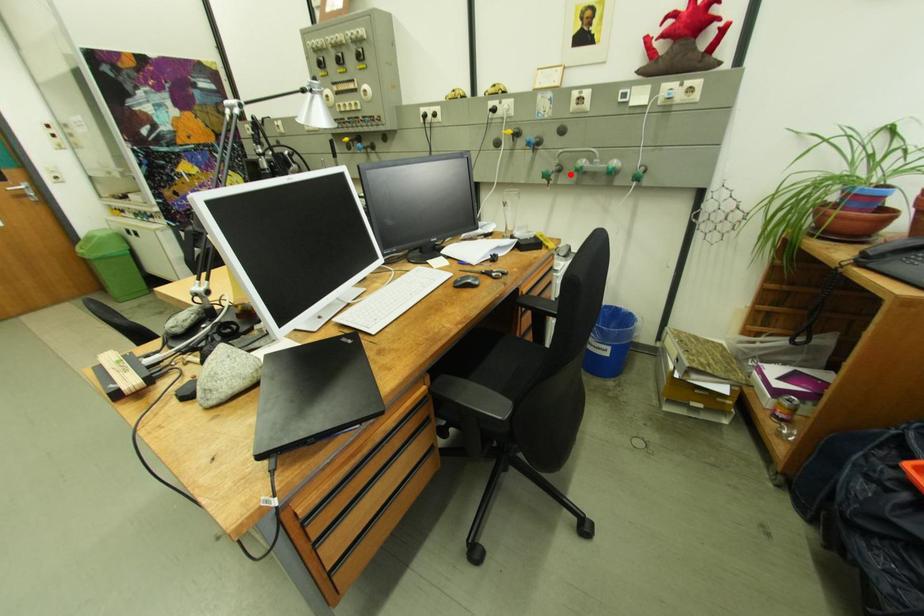
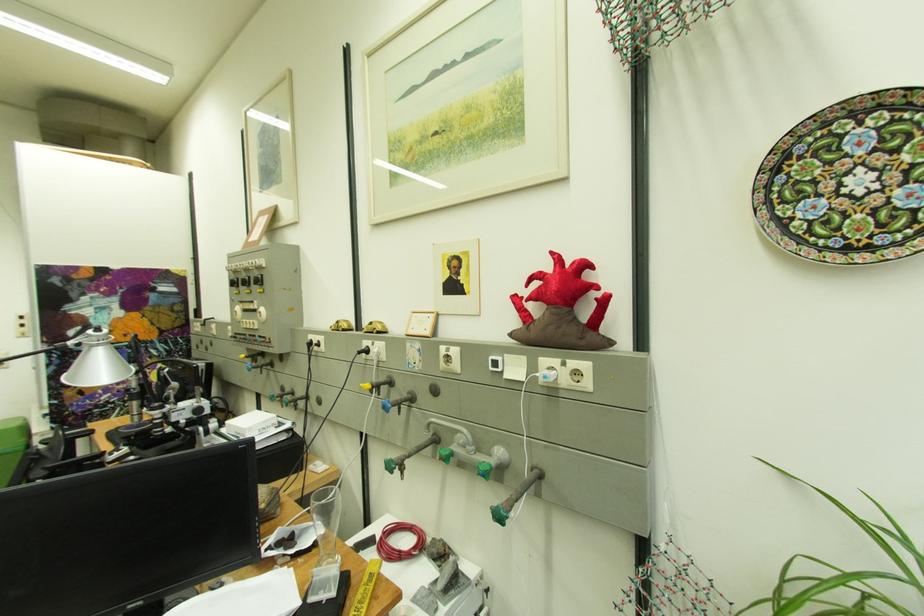
The point at the highlighted location is marked in the first image. Where is the corresponding point in the second image?

(448, 447)